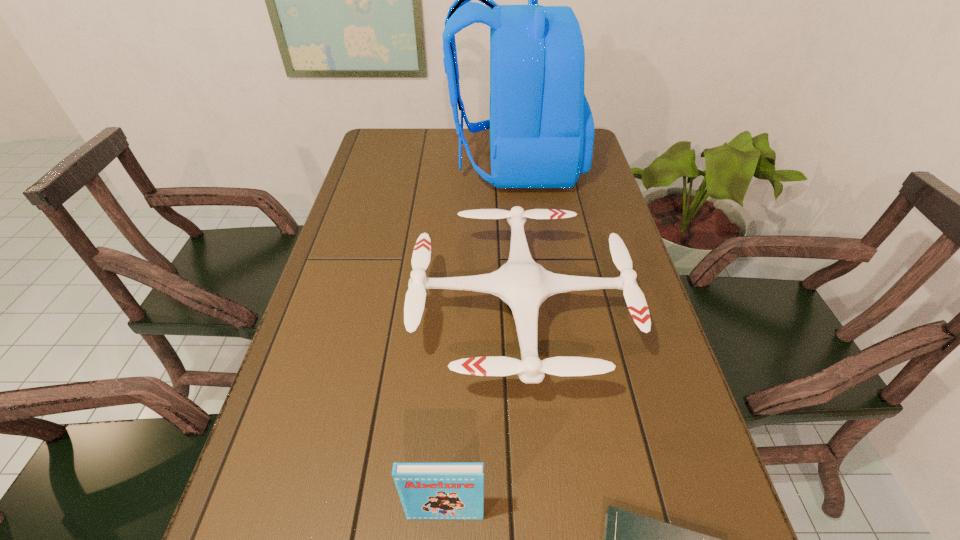
In order to click on free point between the second shortest object and the second tallest object in this screenshot , I will do `click(483, 413)`.

What are the coordinates of `object that is the third closest one to the shorter book` in the screenshot? It's located at [x=541, y=126].

Locate which object is the closest to the drone. Please provide its 2D coordinates. Your answer should be formatted as a tuple, i.e. [(x, y)], where the tuple contains the x and y coordinates of a point satisfying the conditions above.

[(427, 490)]

The image size is (960, 540). I want to click on vacant area in the image that satisfies the following two spatial constraints: 1. on the back of the backpack; 2. on the front cover of the taller book, so click(552, 514).

In order to click on free point that satisfies the following two spatial constraints: 1. on the back of the farthest object; 2. on the front cover of the third shortest object in this screenshot , I will do `click(552, 514)`.

At what (x,y) coordinates should I click in order to perform the action: click on vacant area that satisfies the following two spatial constraints: 1. on the back of the backpack; 2. on the front cover of the third shortest object. Please return your answer as a coordinate pair (x, y). Looking at the image, I should click on (552, 514).

The image size is (960, 540). I want to click on vacant space that satisfies the following two spatial constraints: 1. with the camera attached at the bottom of the third tallest object; 2. on the front cover of the left book, so click(x=537, y=514).